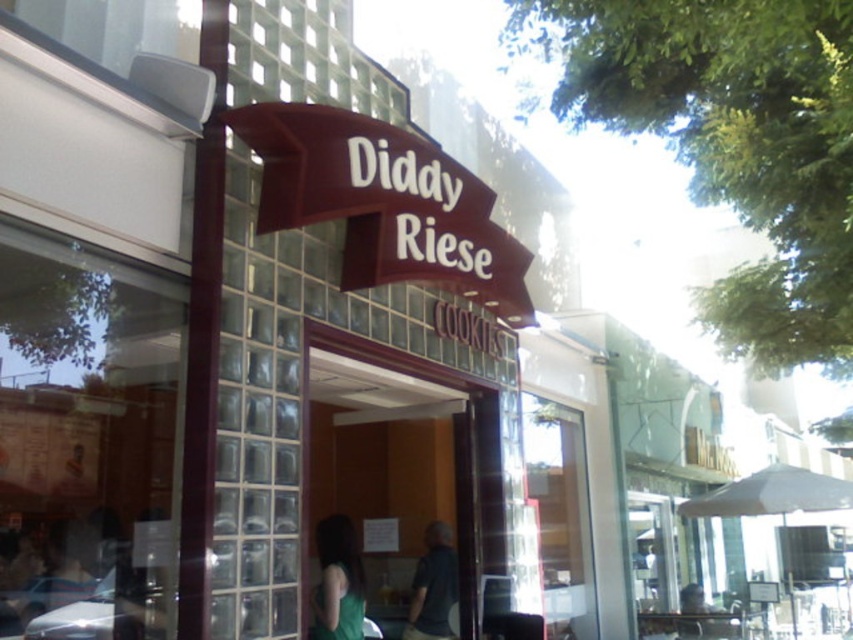
You are standing outside the bakery and see the point marked at coordinates (338,580). What is the object located at that point?

The point at coordinates (338,580) marks the green matte tank top at center.